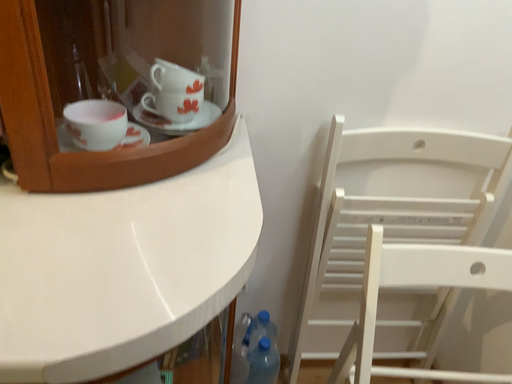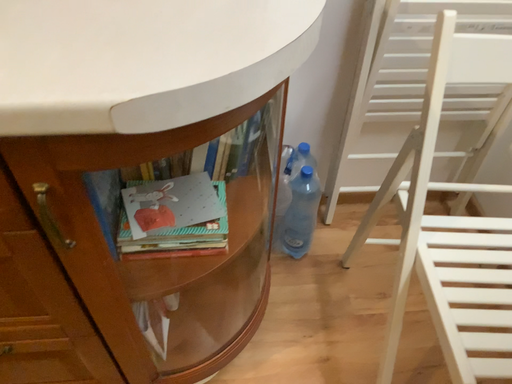
Question: How did the camera likely rotate when shooting the video?

Choices:
 (A) rotated upward
 (B) rotated downward

Answer: (B)